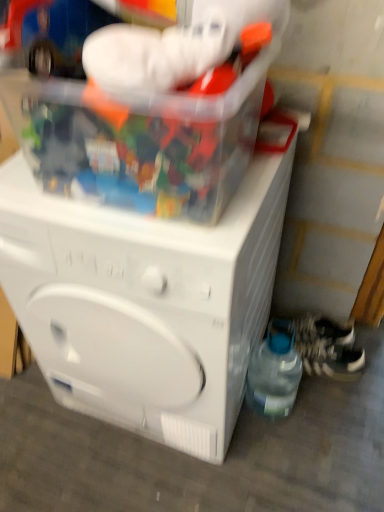
Where is `unoccupied area in front of white textured shoe at lower right, which ranks as the 1th shoe in top-to-bottom order`? This screenshot has height=512, width=384. unoccupied area in front of white textured shoe at lower right, which ranks as the 1th shoe in top-to-bottom order is located at coordinates (337, 388).